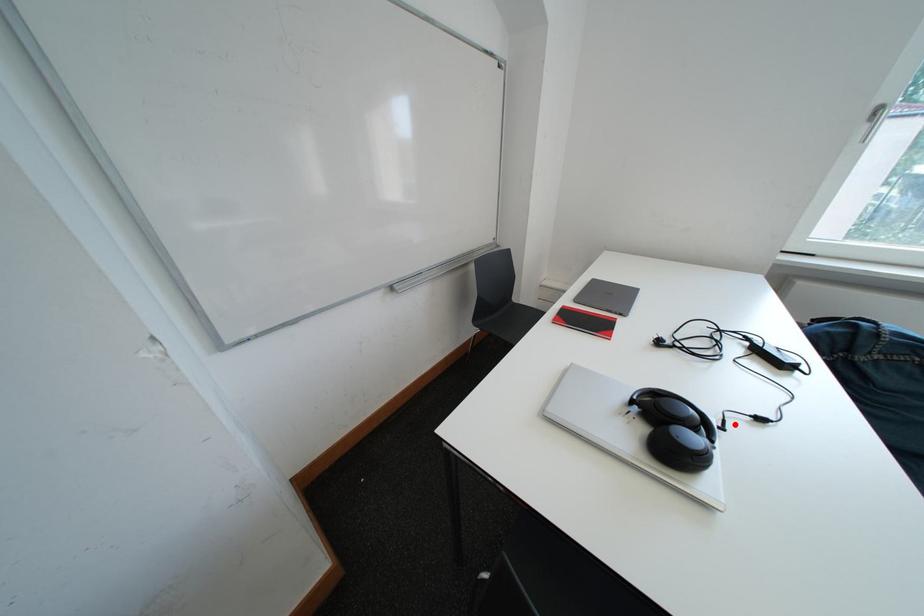
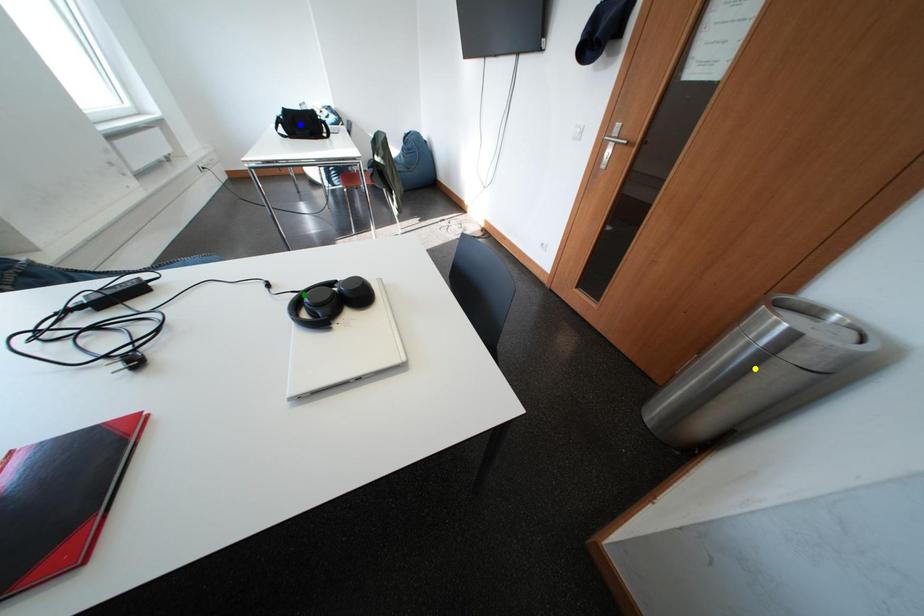
Question: I am providing you with two images of the same scene from different viewpoints. A red point is marked on the first image. You are given multiple points on the second image. Which point in image 2 is actually the same real-world point as the red point in image 1?

Choices:
 (A) blue point
 (B) green point
 (C) yellow point

Answer: (B)